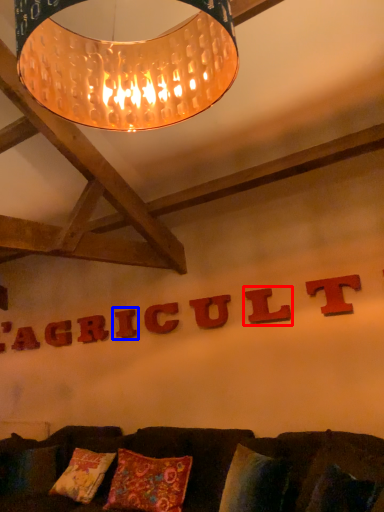
Question: Which object is further to the camera taking this photo, letter (highlighted by a red box) or letter (highlighted by a blue box)?

Choices:
 (A) letter
 (B) letter

Answer: (B)